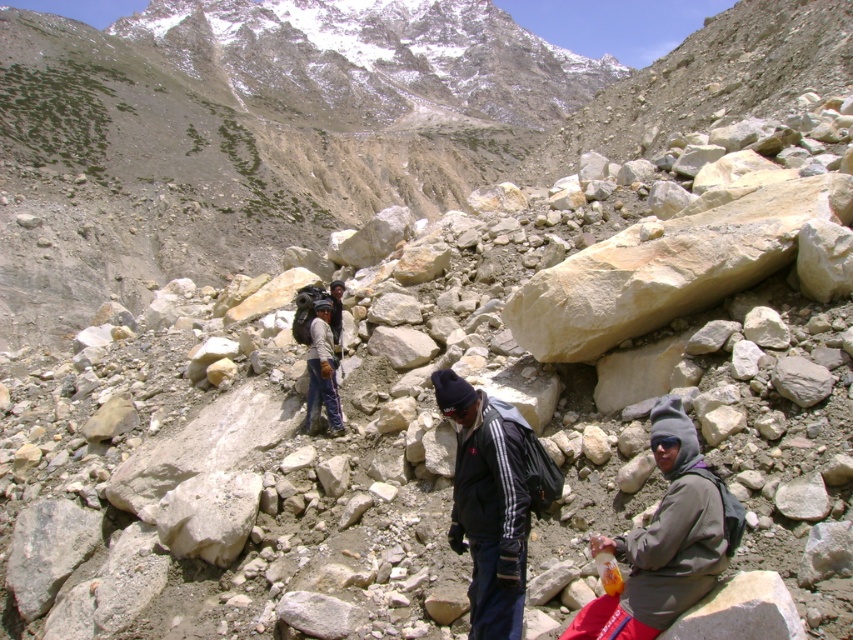
Question: Does gray fleece jacket at lower right have a larger size compared to dark gray fleece jacket at center?

Choices:
 (A) no
 (B) yes

Answer: (A)

Question: Which of the following is the closest to the observer?

Choices:
 (A) (467, 385)
 (B) (677, 605)

Answer: (B)

Question: Does gray fleece jacket at lower right have a lesser width compared to dark gray fleece jacket at center?

Choices:
 (A) no
 (B) yes

Answer: (B)

Question: Does gray fleece jacket at lower right have a lesser width compared to dark gray fleece jacket at center?

Choices:
 (A) no
 (B) yes

Answer: (B)